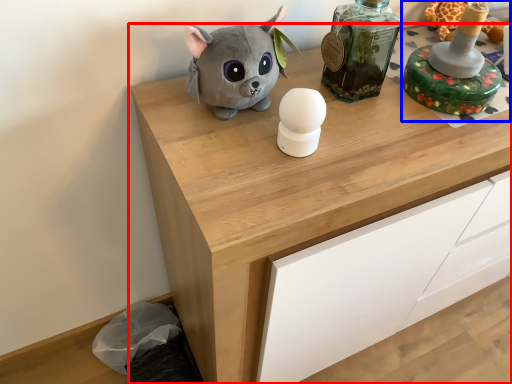
Question: Among these objects, which one is farthest to the camera, chest of drawers (highlighted by a red box) or toy (highlighted by a blue box)?

Choices:
 (A) chest of drawers
 (B) toy

Answer: (B)